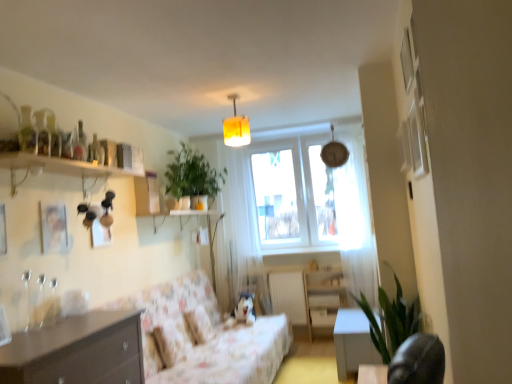
Question: Relative to white sheer curtain at center, the first curtain from the left, is wooden shelf at upper left in front or behind?

Choices:
 (A) behind
 (B) front

Answer: (B)

Question: From the image's perspective, relative to white sheer curtain at center, which appears as the 2th curtain when viewed from the front, is wooden shelf at upper left above or below?

Choices:
 (A) above
 (B) below

Answer: (A)

Question: Which is nearer to the fluffy white pillow at center?

Choices:
 (A) white sheer curtain at upper right, the second curtain when ordered from back to front
 (B) white sheer curtain at center, which appears as the 2th curtain when viewed from the front
 (C) green matte plant at upper center, the 2th plant in the bottom-to-top sequence
 (D) matte brown drawer at lower center
 (E) white glossy table at lower right

Answer: (B)

Question: Estimate the real-world distances between objects in this image. Which object is farther from the wooden shelf at upper left?

Choices:
 (A) floral fabric couch at center
 (B) wooden cabinet at lower right
 (C) dark wood chest of drawers at lower left
 (D) white glossy table at lower right
 (E) green matte plant at upper center, which is counted as the first plant, starting from the left

Answer: (B)